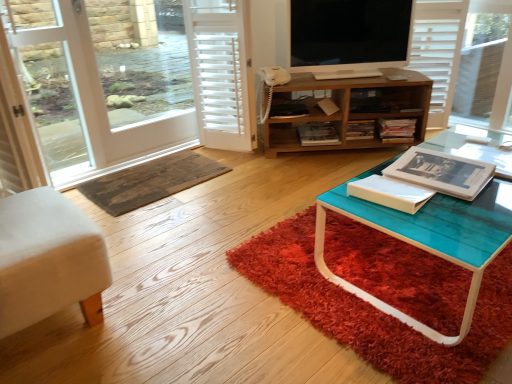
Where is `vacant area located to the right-hand side of wooden textured doormat at center, which appears as the 1th doormat when viewed from the back`? The height and width of the screenshot is (384, 512). vacant area located to the right-hand side of wooden textured doormat at center, which appears as the 1th doormat when viewed from the back is located at coordinates (251, 178).